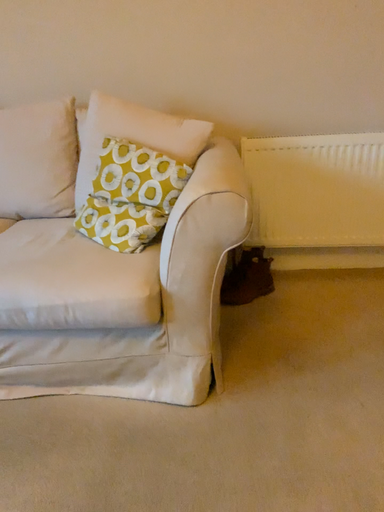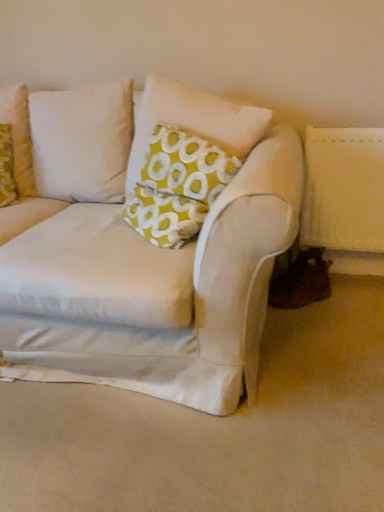
Question: Which way did the camera rotate in the video?

Choices:
 (A) rotated left
 (B) rotated right

Answer: (A)